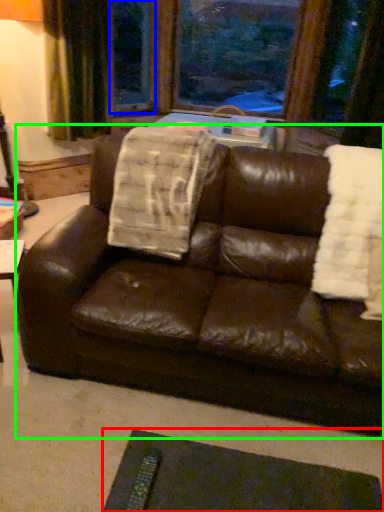
Question: Based on their relative distances, which object is nearer to flat (highlighted by a red box)? Choose from window screen (highlighted by a blue box) and studio couch (highlighted by a green box).

Choices:
 (A) window screen
 (B) studio couch

Answer: (B)